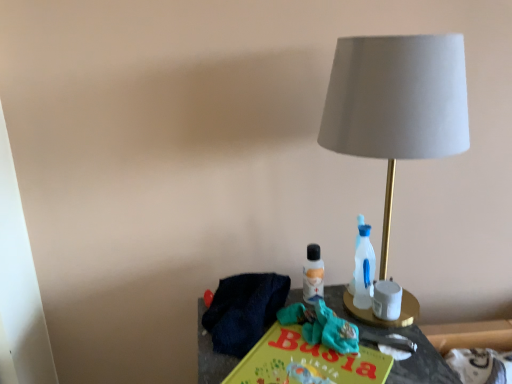
Identify the location of vacant area situated to the left side of white matte candle holder at right. (290, 354).